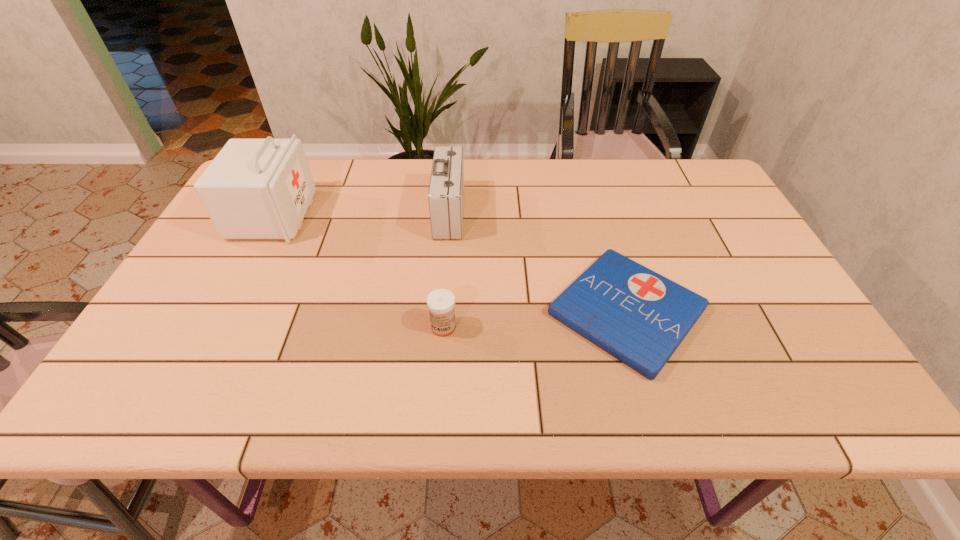
At what (x,y) coordinates should I click in order to perform the action: click on free location that satisfies the following two spatial constraints: 1. on the front-facing side of the leftmost object; 2. on the back side of the second shortest object. Please return your answer as a coordinate pair (x, y). The width and height of the screenshot is (960, 540). Looking at the image, I should click on (215, 327).

Where is `vacant region that satisfies the following two spatial constraints: 1. on the front-facing side of the tallest first-aid kit; 2. on the left side of the rightmost first-aid kit`? vacant region that satisfies the following two spatial constraints: 1. on the front-facing side of the tallest first-aid kit; 2. on the left side of the rightmost first-aid kit is located at coordinates click(223, 311).